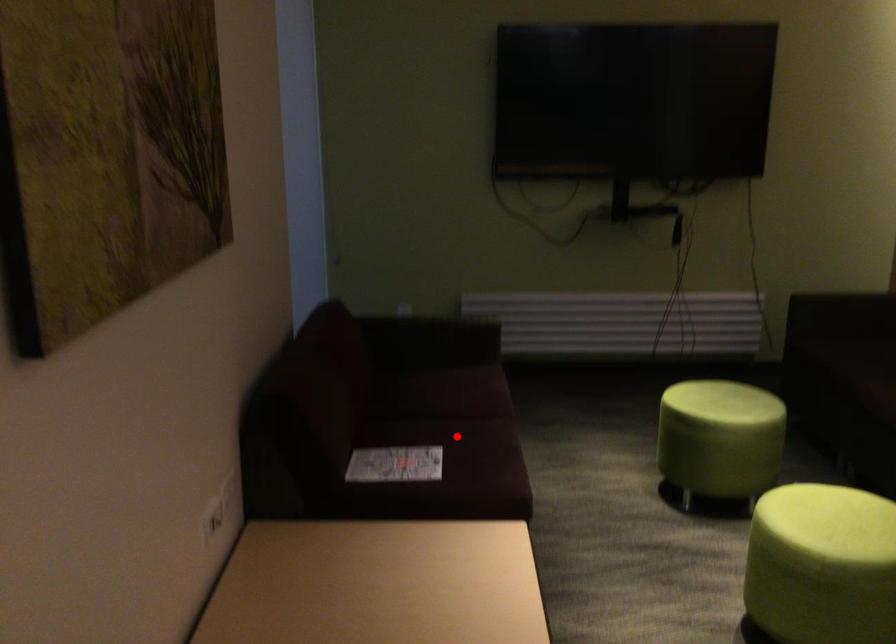
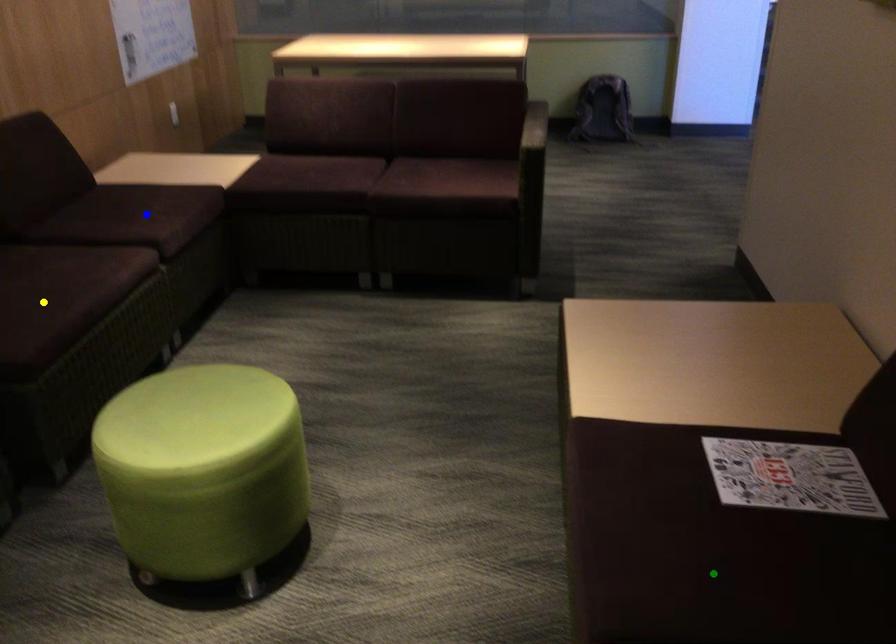
Question: I am providing you with two images of the same scene from different viewpoints. A red point is marked on the first image. You are given multiple points on the second image. Which point in image 2 is actually the same real-world point as the red point in image 1?

Choices:
 (A) blue point
 (B) green point
 (C) yellow point

Answer: (B)